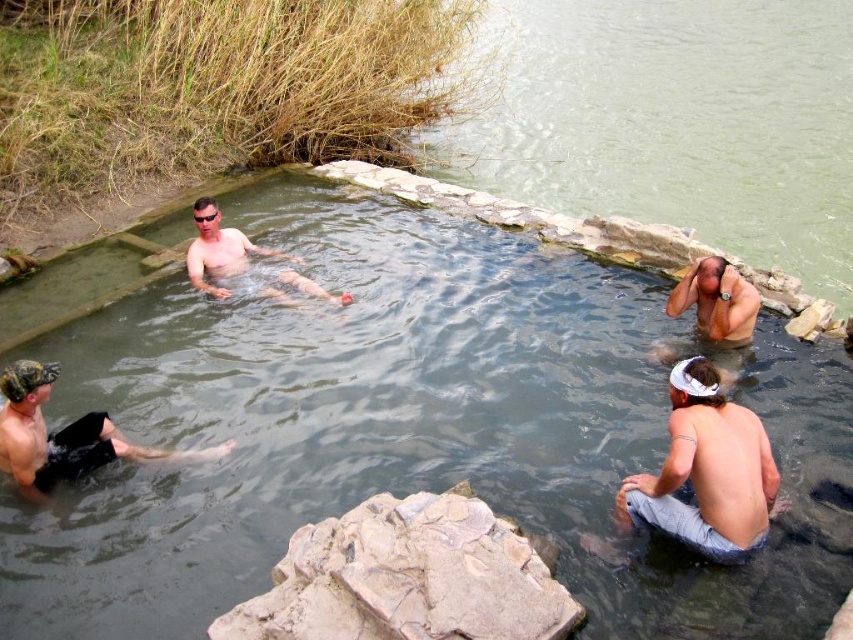
Question: Does rough textured rock at center come behind gray denim shorts at lower right?

Choices:
 (A) yes
 (B) no

Answer: (B)

Question: Can you confirm if rough textured rock at center is positioned to the left of black matte shorts at lower left?

Choices:
 (A) yes
 (B) no

Answer: (B)

Question: Which of the following is the closest to the observer?

Choices:
 (A) gray denim shorts at lower right
 (B) rough textured rock at center

Answer: (B)

Question: Is gray denim shorts at lower right smaller than smooth skin head at upper right?

Choices:
 (A) no
 (B) yes

Answer: (A)

Question: Which object appears farthest from the camera in this image?

Choices:
 (A) clear stone pool at center
 (B) matte skin man at center
 (C) smooth skin head at upper right

Answer: (B)

Question: Based on their relative distances, which object is farther from the clear stone pool at center?

Choices:
 (A) smooth skin head at upper right
 (B) matte skin man at center
 (C) gray denim shorts at lower right
 (D) rough textured rock at center

Answer: (B)